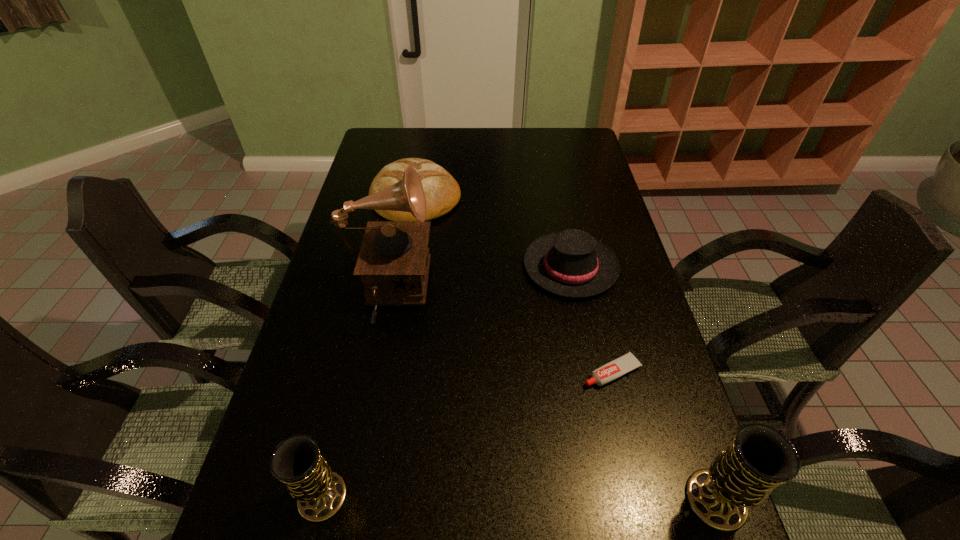
If we want them evenly spaced by inserting an extra chalice among them, please locate a free spot for this new chalice. Please provide its 2D coordinates. Your answer should be formatted as a tuple, i.e. [(x, y)], where the tuple contains the x and y coordinates of a point satisfying the conditions above.

[(518, 498)]